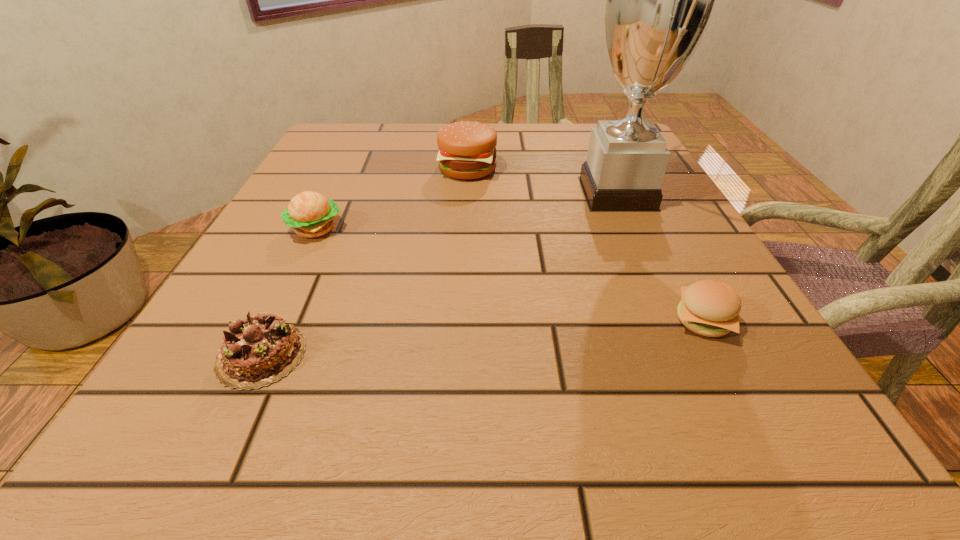
Where is `vacant space that satisfies the following two spatial constraints: 1. on the back side of the shortest object; 2. on the right side of the rightmost hamburger`? vacant space that satisfies the following two spatial constraints: 1. on the back side of the shortest object; 2. on the right side of the rightmost hamburger is located at coordinates (277, 321).